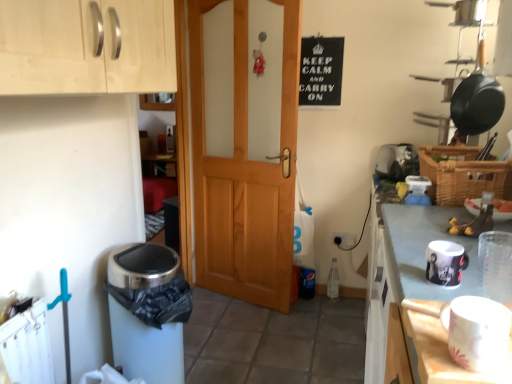
Question: Is light wood cabinet at upper left in front of or behind wooden door at center in the image?

Choices:
 (A) front
 (B) behind

Answer: (A)

Question: Would you say light wood cabinet at upper left is to the left or to the right of wooden door at center in the picture?

Choices:
 (A) right
 (B) left

Answer: (B)

Question: Considering the real-world distances, which object is closest to the wooden door at center?

Choices:
 (A) woven brown basket at right
 (B) white matte table at lower right
 (C) matte black mug at right, the first appliance positioned from the left
 (D) light wood cabinet at upper left
 (E) white plastic toaster at upper right, the 2th appliance in the left-to-right sequence

Answer: (E)

Question: Which object is positioned closest to the white glossy mug at upper right?

Choices:
 (A) matte black mug at right, the first appliance positioned from the left
 (B) woven brown basket at right
 (C) light wood cabinet at upper left
 (D) black matte sign at upper center
 (E) white matte table at lower right

Answer: (A)